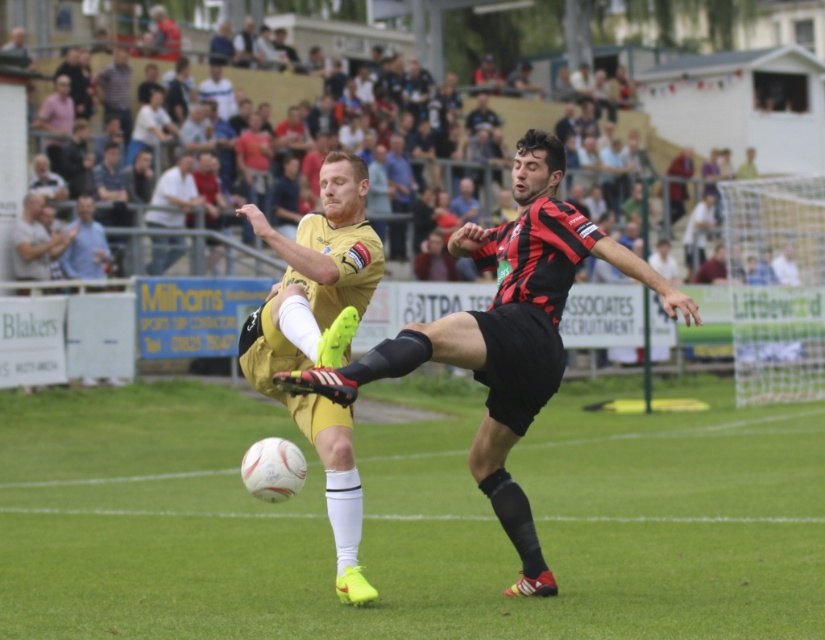
Question: Which object appears farthest from the camera in this image?

Choices:
 (A) green grass at center
 (B) yellow matte jersey at center

Answer: (B)

Question: Among these objects, which one is farthest from the camera?

Choices:
 (A) light beige shirt at upper center
 (B) yellow matte jersey at center
 (C) matte gold jersey at center
 (D) green grass at center

Answer: (A)

Question: Which point appears closest to the camera in this image?

Choices:
 (A) (191, 166)
 (B) (266, 388)
 (C) (566, 276)
 (D) (29, 412)

Answer: (B)

Question: Does green grass at center appear on the left side of yellow matte jersey at center?

Choices:
 (A) no
 (B) yes

Answer: (A)

Question: Can you confirm if green grass at center is positioned above yellow matte jersey at center?

Choices:
 (A) no
 (B) yes

Answer: (A)

Question: Is matte gold jersey at center below yellow matte jersey at center?

Choices:
 (A) no
 (B) yes

Answer: (B)